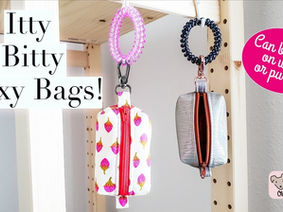
You are a GUI agent. You are given a task and a screenshot of the screen. Output one action in this format:
    pyautogui.click(x=<x>, y=<y>)
    Task: Click on the white wall
    This screenshot has height=212, width=283.
    Given the screenshot: What is the action you would take?
    pyautogui.click(x=77, y=162)